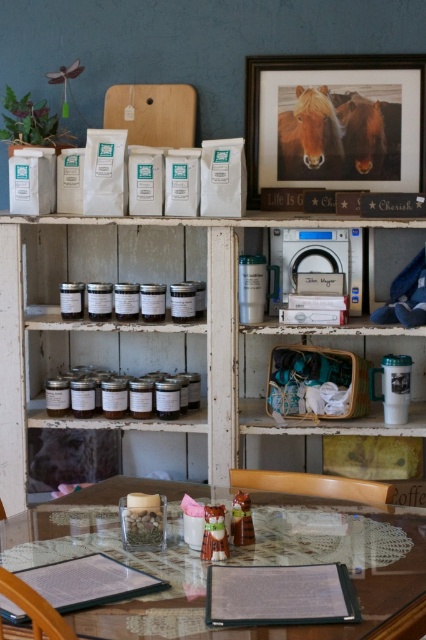
Question: Does transparent glass table at center have a larger size compared to light brown wooden chair at center?

Choices:
 (A) no
 (B) yes

Answer: (B)

Question: Estimate the real-world distances between objects in this image. Which object is closer to the wooden chair at lower left?

Choices:
 (A) clear glass jars at center
 (B) transparent glass table at center
 (C) wooden framed picture at upper center

Answer: (B)

Question: Does white wood pantry at center have a lesser width compared to wooden chair at lower left?

Choices:
 (A) yes
 (B) no

Answer: (B)

Question: Estimate the real-world distances between objects in this image. Which object is farther from the transparent glass table at center?

Choices:
 (A) white wood pantry at center
 (B) clear glass jars at center

Answer: (A)

Question: Estimate the real-world distances between objects in this image. Which object is closer to the light brown wooden chair at center?

Choices:
 (A) white wood pantry at center
 (B) wooden framed picture at upper center
 (C) clear glass jars at center
 (D) transparent glass table at center

Answer: (D)

Question: Can you confirm if white wood pantry at center is bigger than light brown wooden chair at center?

Choices:
 (A) yes
 (B) no

Answer: (A)